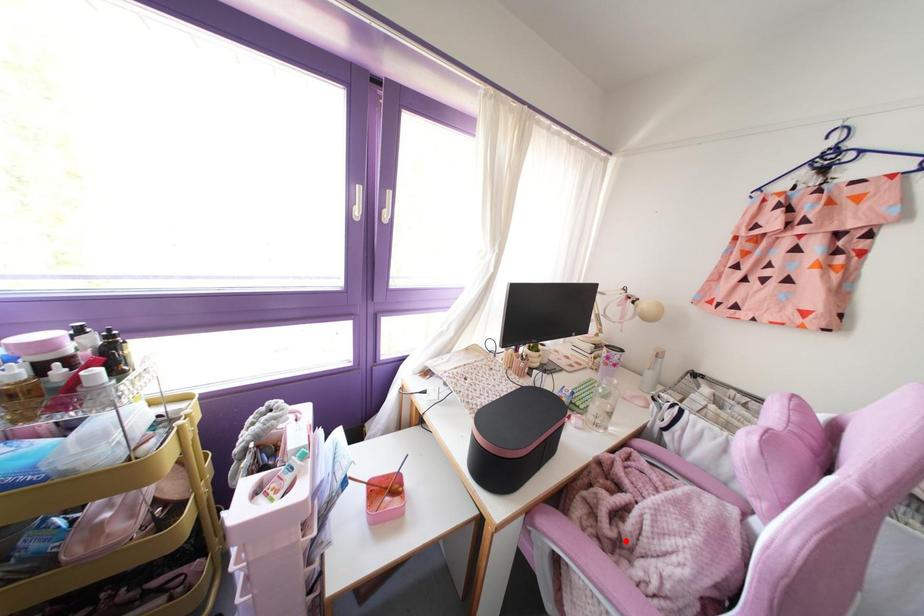
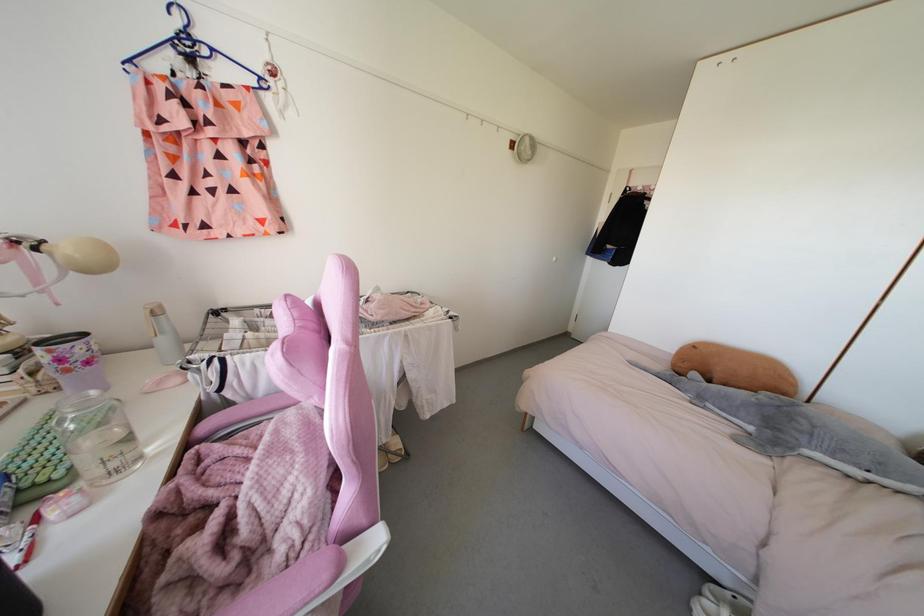
Locate, in the second image, the point that corresponds to the highlighted location in the first image.

(252, 543)